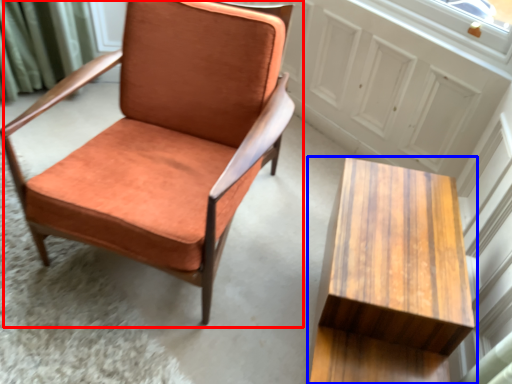
Question: Which of the following is the farthest to the observer, chair (highlighted by a red box) or table (highlighted by a blue box)?

Choices:
 (A) chair
 (B) table

Answer: (A)